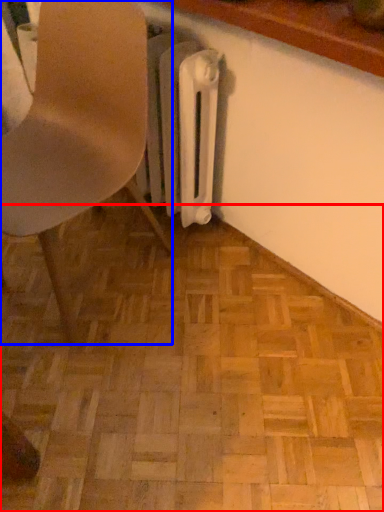
Question: Which point is further to the camera, plywood (highlighted by a red box) or chair (highlighted by a blue box)?

Choices:
 (A) plywood
 (B) chair

Answer: (A)